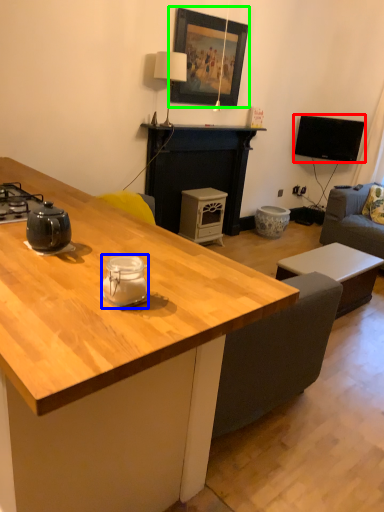
Question: Which is nearer to the television (highlighted by a red box)? appliance (highlighted by a blue box) or picture frame (highlighted by a green box).

Choices:
 (A) appliance
 (B) picture frame

Answer: (B)